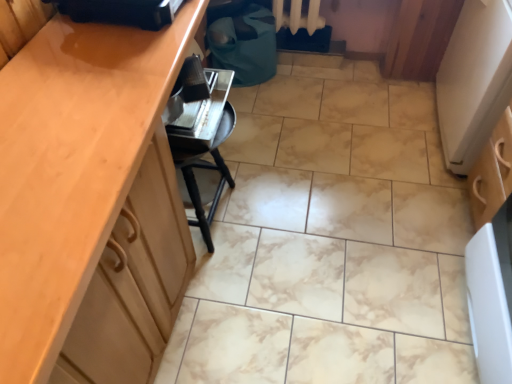
Identify the location of free location above matte wood cabinet at left (from a real-world perspective). (101, 93).